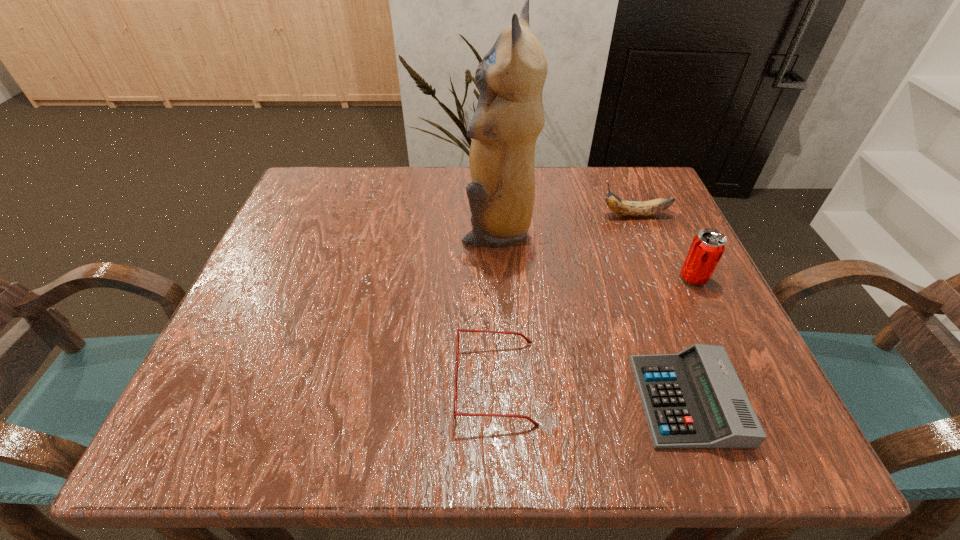
Locate an element on the screen. free space at the far left corner is located at coordinates point(351,183).

The width and height of the screenshot is (960, 540). Identify the location of free area in between the tallest object and the banana. (566, 221).

Locate an element on the screen. Image resolution: width=960 pixels, height=540 pixels. free spot between the second tallest object and the fourth tallest object is located at coordinates (595, 330).

In order to click on vacant point located between the shortest object and the tallest object in this screenshot , I will do `click(592, 314)`.

Locate an element on the screen. The height and width of the screenshot is (540, 960). vacant space that's between the cat and the third farthest object is located at coordinates (595, 253).

The width and height of the screenshot is (960, 540). In order to click on free area in between the soda can and the third tallest object in this screenshot , I will do `click(664, 246)`.

This screenshot has height=540, width=960. What are the coordinates of `vacant area between the tallest object and the calculator` in the screenshot? It's located at (592, 314).

Image resolution: width=960 pixels, height=540 pixels. What are the coordinates of `vacant area that lies between the second shortest object and the shortest object` in the screenshot? It's located at (591, 392).

The image size is (960, 540). Find the location of `vacant area between the spectacles and the calculator`. vacant area between the spectacles and the calculator is located at coordinates (591, 392).

Where is `unoccupied area between the banana and the third nearest object`? unoccupied area between the banana and the third nearest object is located at coordinates (664, 246).